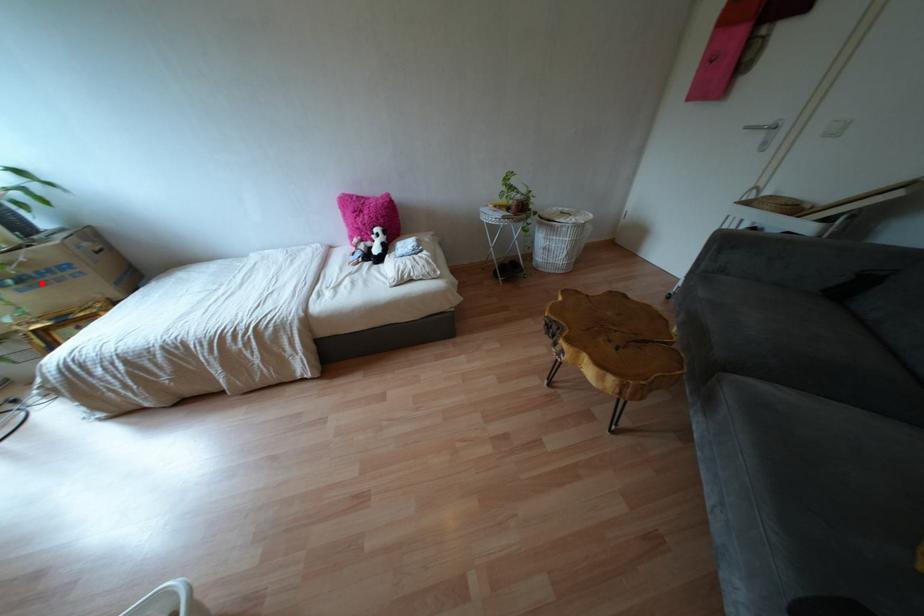
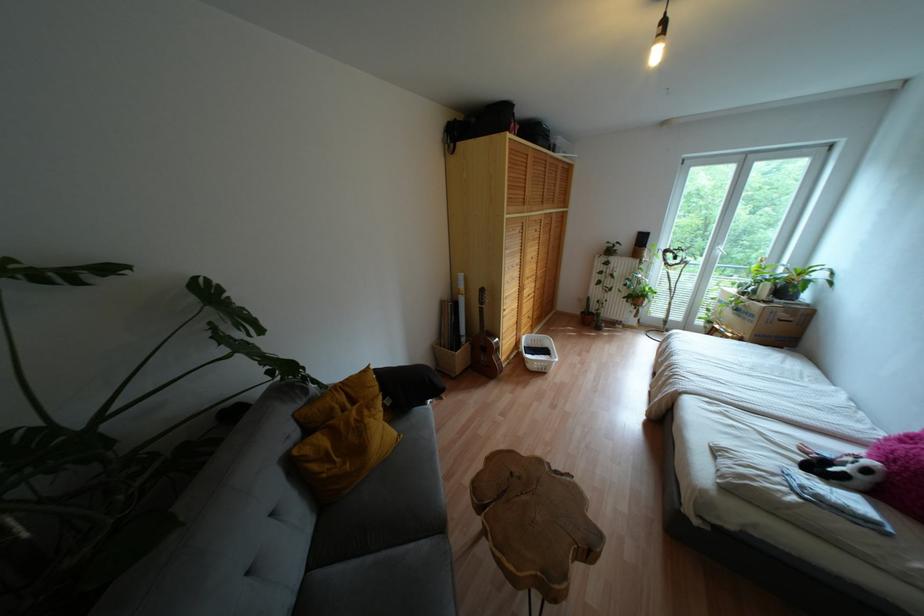
Where in the second image is the point corresponding to the highlighted location from the first image?

(737, 315)